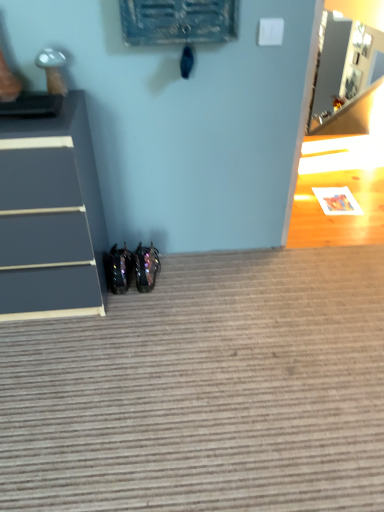
Question: Should I look upward or downward to see textured gray carpet at lower center?

Choices:
 (A) down
 (B) up

Answer: (A)

Question: Does glossy black shoes at lower center, which is the 2th footwear from right to left, have a larger size compared to textured gray carpet at lower center?

Choices:
 (A) no
 (B) yes

Answer: (A)

Question: Is glossy black shoes at lower center, which is counted as the 1th footwear, starting from the left, further to camera compared to textured gray carpet at lower center?

Choices:
 (A) no
 (B) yes

Answer: (B)

Question: From the image's perspective, is glossy black shoes at lower center, which is the 2th footwear from right to left, located beneath textured gray carpet at lower center?

Choices:
 (A) yes
 (B) no

Answer: (B)

Question: Considering the relative sizes of glossy black shoes at lower center, which is the 2th footwear from right to left, and textured gray carpet at lower center in the image provided, is glossy black shoes at lower center, which is the 2th footwear from right to left, taller than textured gray carpet at lower center?

Choices:
 (A) no
 (B) yes

Answer: (B)

Question: Does glossy black shoes at lower center, which is counted as the 1th footwear, starting from the left, have a smaller size compared to textured gray carpet at lower center?

Choices:
 (A) no
 (B) yes

Answer: (B)

Question: Is glossy black shoes at lower center, which is counted as the 1th footwear, starting from the left, next to textured gray carpet at lower center?

Choices:
 (A) yes
 (B) no

Answer: (B)

Question: Is textured gray carpet at lower center outside glossy black shoes at lower center, which is counted as the 1th footwear, starting from the left?

Choices:
 (A) yes
 (B) no

Answer: (A)

Question: From the image's perspective, is textured gray carpet at lower center under glossy black shoes at lower center, which is counted as the 1th footwear, starting from the left?

Choices:
 (A) yes
 (B) no

Answer: (A)

Question: Can you confirm if textured gray carpet at lower center is smaller than glossy black shoes at lower center, which is counted as the 1th footwear, starting from the left?

Choices:
 (A) yes
 (B) no

Answer: (B)

Question: From a real-world perspective, is textured gray carpet at lower center on glossy black shoes at lower center, which is the 2th footwear from right to left?

Choices:
 (A) no
 (B) yes

Answer: (A)

Question: Does textured gray carpet at lower center have a lesser height compared to glossy black shoes at lower center, which is the 2th footwear from right to left?

Choices:
 (A) no
 (B) yes

Answer: (B)

Question: Is textured gray carpet at lower center at the right side of glossy black shoes at lower center, which is counted as the 1th footwear, starting from the left?

Choices:
 (A) no
 (B) yes

Answer: (B)

Question: Does matte gray chest of drawers at left come behind glossy black shoes at lower center, which is counted as the 1th footwear, starting from the left?

Choices:
 (A) no
 (B) yes

Answer: (A)